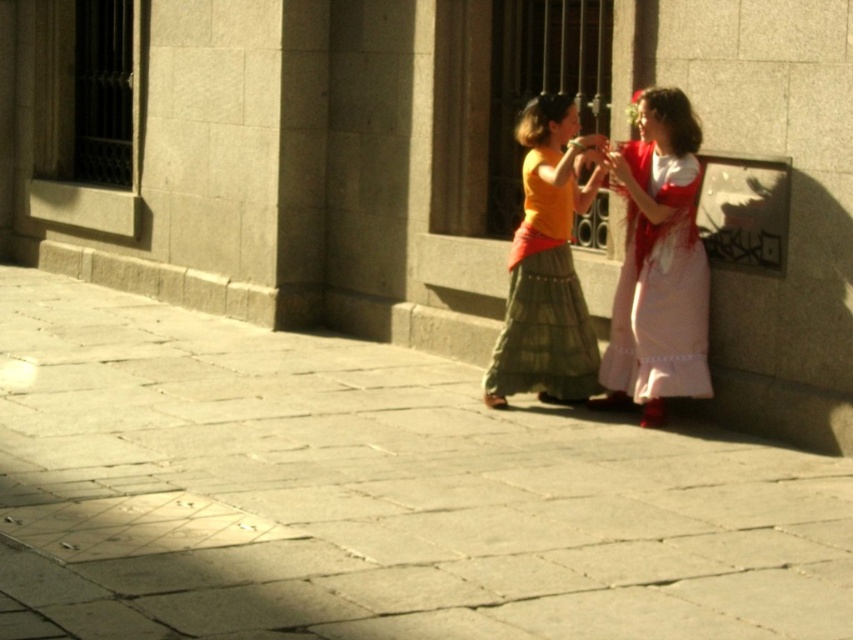
Question: Does matte red dress at center appear on the left side of matte yellow blouse at center?

Choices:
 (A) no
 (B) yes

Answer: (A)

Question: Which object is farther from the camera taking this photo?

Choices:
 (A) matte yellow blouse at center
 (B) matte red dress at center
 (C) smooth stone pavement at center
 (D) silky white flower at upper right

Answer: (D)

Question: Which point is closer to the camera?

Choices:
 (A) (581, 138)
 (B) (701, 314)
 (C) (68, 582)
 (D) (636, 97)

Answer: (C)

Question: Is the position of smooth stone pavement at center more distant than that of silky white flower at upper right?

Choices:
 (A) yes
 (B) no

Answer: (B)

Question: Which object is positioned farthest from the silky white flower at upper right?

Choices:
 (A) smooth stone pavement at center
 (B) matte red dress at center
 (C) matte yellow blouse at center

Answer: (A)

Question: Is smooth stone pavement at center positioned behind silky white flower at upper right?

Choices:
 (A) no
 (B) yes

Answer: (A)